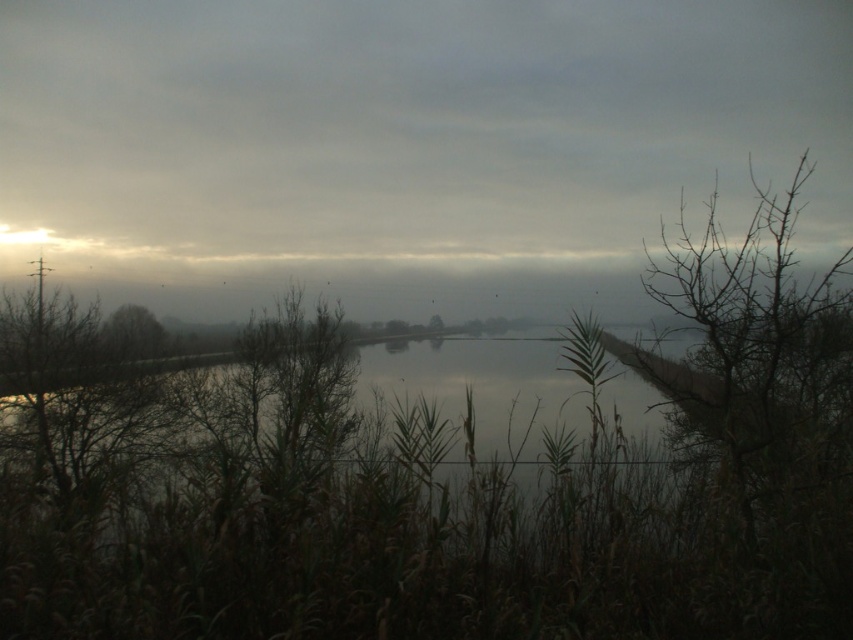
Between point (126, 349) and point (427, 326), which one is positioned in front?

Point (427, 326) is in front.

Based on the photo, can you confirm if brown leafless tree at left is positioned to the right of green leafy tree at center?

In fact, brown leafless tree at left is to the left of green leafy tree at center.

This screenshot has height=640, width=853. I want to click on brown leafless tree at left, so click(x=131, y=333).

At what (x,y) coordinates should I click in order to perform the action: click on brown leafless tree at left. Please return your answer as a coordinate pair (x, y). The image size is (853, 640). Looking at the image, I should click on (131, 333).

Can you confirm if bare branches at right is positioned above brown leafless tree at left?

Indeed, bare branches at right is positioned over brown leafless tree at left.

The height and width of the screenshot is (640, 853). What are the coordinates of `bare branches at right` in the screenshot? It's located at (761, 346).

Is bare branches at right smaller than green leafy tree at center?

Yes.

Is bare branches at right taller than green leafy tree at center?

No, bare branches at right is not taller than green leafy tree at center.

What do you see at coordinates (761, 346) in the screenshot? I see `bare branches at right` at bounding box center [761, 346].

Image resolution: width=853 pixels, height=640 pixels. Identify the location of bare branches at right. (761, 346).